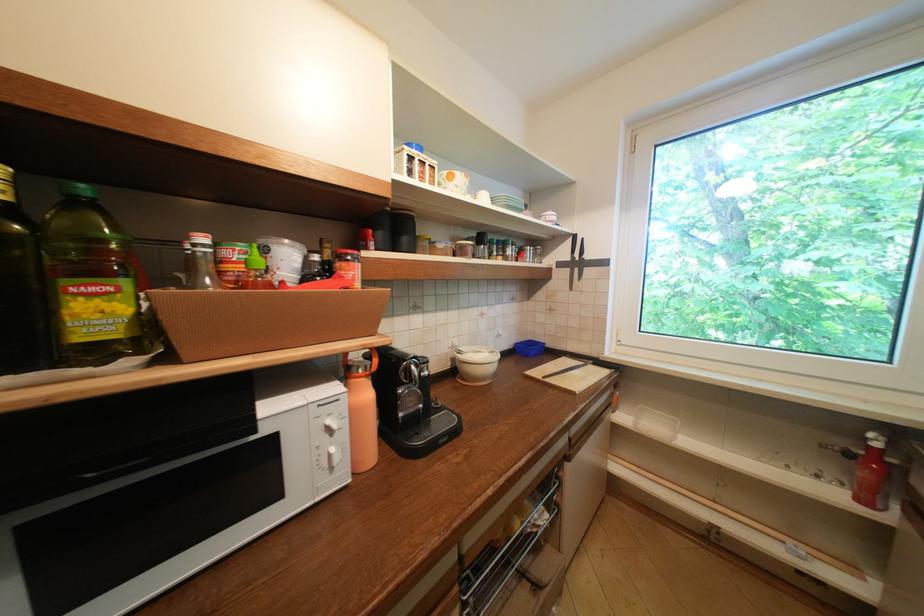
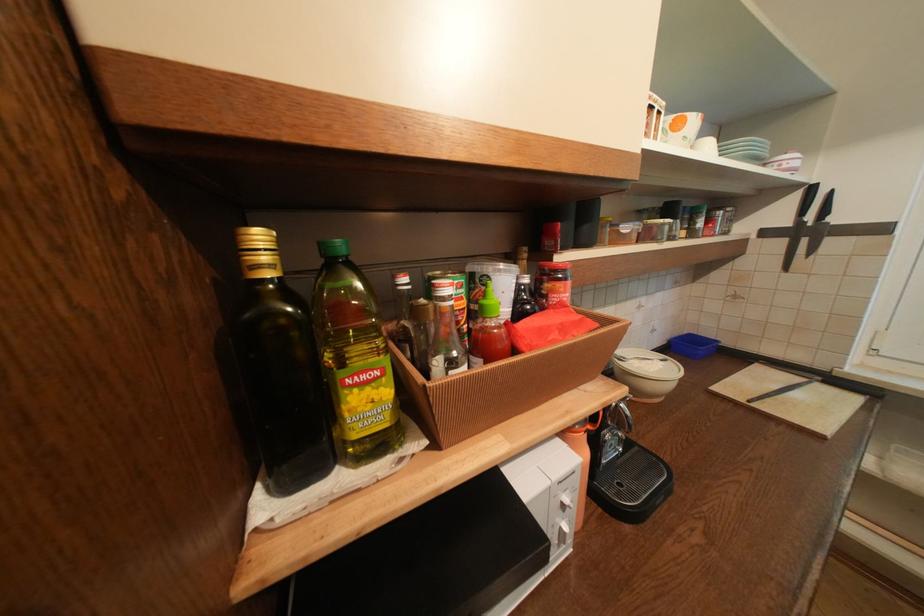
The point at (110,291) is marked in the first image. Where is the corresponding point in the second image?

(379, 377)